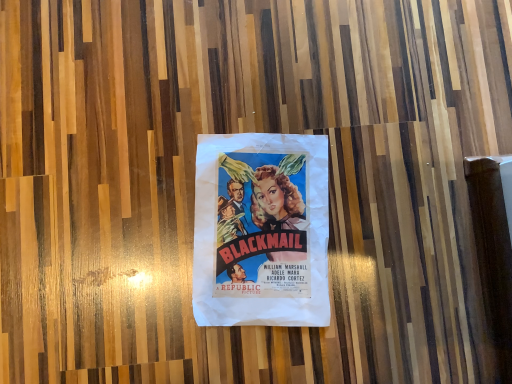
You are a GUI agent. You are given a task and a screenshot of the screen. Output one action in this format:
    pyautogui.click(x=<x>, y=<y>)
    Task: Click on the empty space that is ontop of matte paper poster at center
    
    Given the screenshot: What is the action you would take?
    pyautogui.click(x=263, y=226)